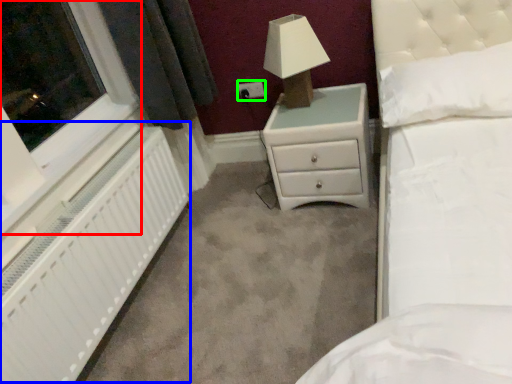
Question: Which object is positioned closest to window (highlighted by a red box)? Select from radiator (highlighted by a blue box) and electric outlet (highlighted by a green box).

Choices:
 (A) radiator
 (B) electric outlet

Answer: (A)